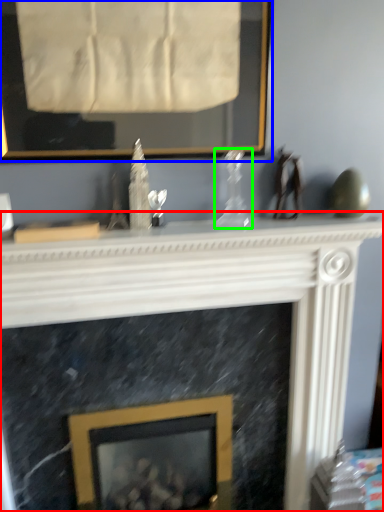
Question: Which is nearer to the fireplace (highlighted by a red box)? picture frame (highlighted by a blue box) or glass vase (highlighted by a green box).

Choices:
 (A) picture frame
 (B) glass vase

Answer: (B)